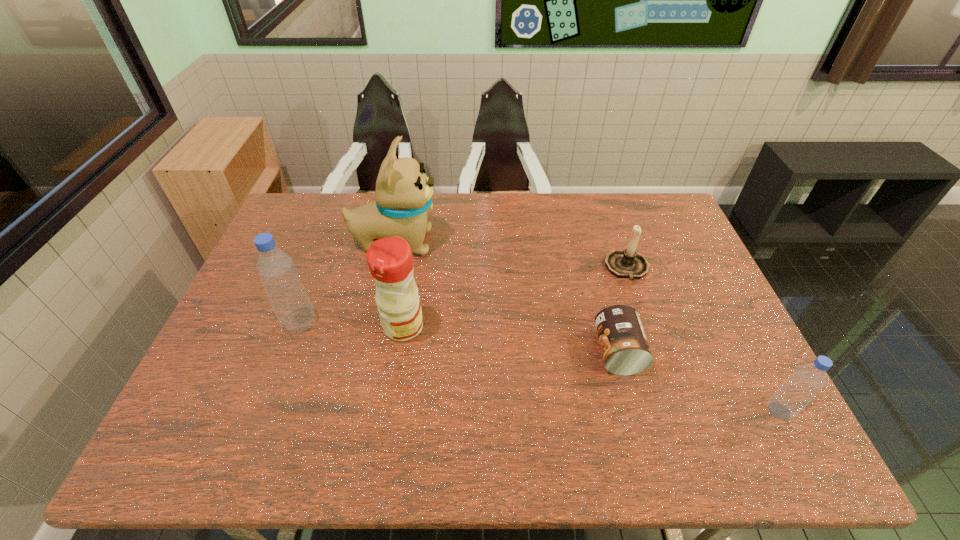
Identify the location of location for an additional bottle to make spacing equal. This screenshot has height=540, width=960. (519, 363).